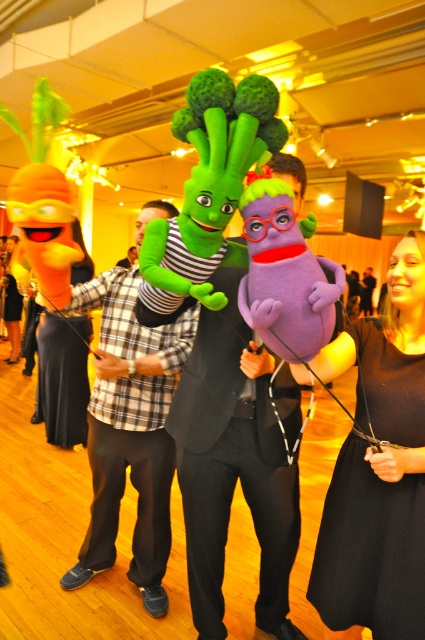
You are at a party and see a black satin dress at lower right and a green plush toy at center. Which object is closer to the ground?

The black satin dress at lower right is positioned under the green plush toy at center, so it is closer to the ground.

You are at a party and want to take a photo with the black satin dress at lower right and the green plush toy at center. Which object is taller so it can be framed properly in the photo?

The black satin dress at lower right is taller than the green plush toy at center, so it should be framed to accommodate its height in the photo.